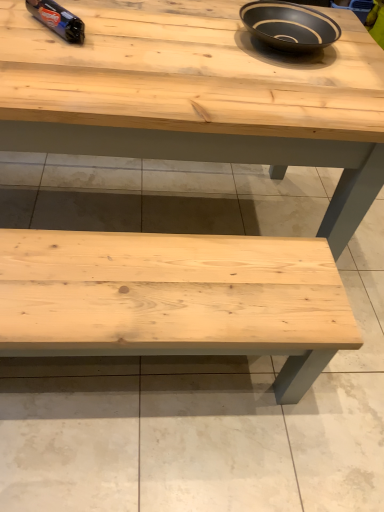
This screenshot has width=384, height=512. I want to click on vacant space that is to the left of shiny blue plastic bottle at upper left, so click(18, 19).